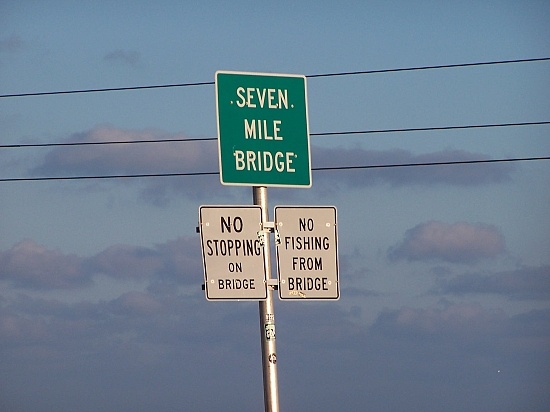
Image resolution: width=550 pixels, height=412 pixels. I want to click on sticker, so click(267, 328), click(273, 358).